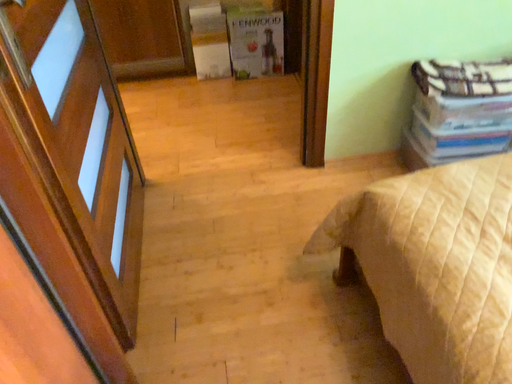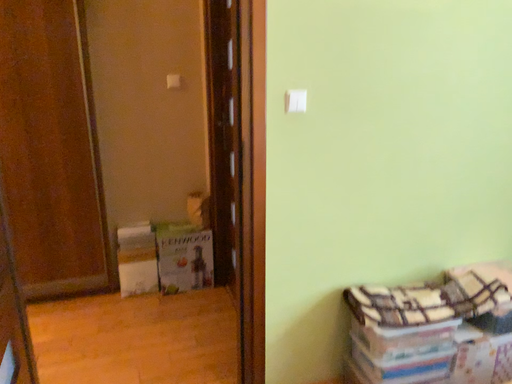
Question: Which way did the camera rotate in the video?

Choices:
 (A) rotated downward
 (B) rotated upward

Answer: (B)